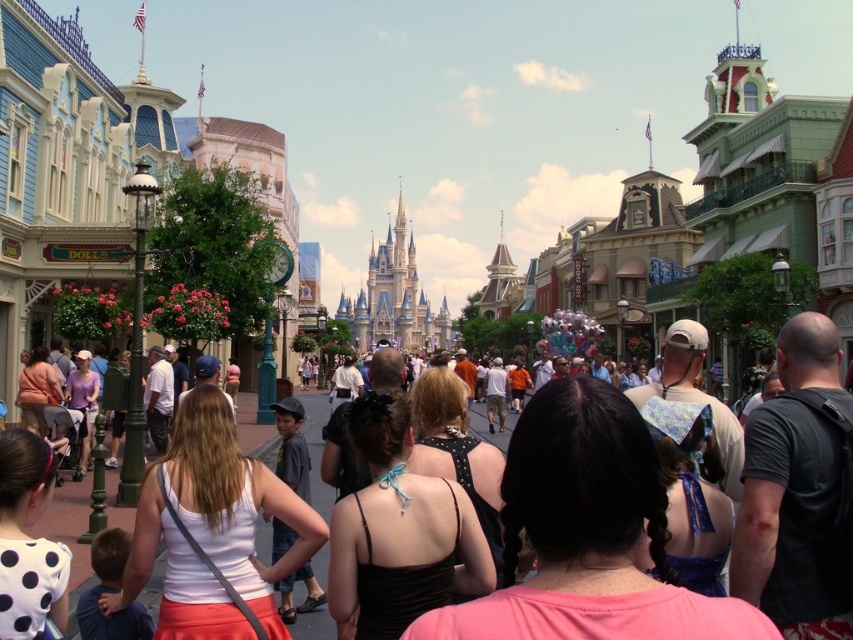
Which is behind, point (427, 577) or point (96, 404)?

Point (96, 404)

In the scene shown: Who is more forward, (381, 556) or (68, 403)?

Point (381, 556) is in front.

Image resolution: width=853 pixels, height=640 pixels. Identify the location of black satin tank top at center. (399, 531).

Does point (315, 516) come farther from viewer compared to point (483, 531)?

No, it is in front of (483, 531).

Measure the distance between point (264, 572) and camera.

Point (264, 572) and camera are 155.76 feet apart from each other.

Identify the location of white matte tank top at center. (213, 529).

Which of these two, black satin dress at center or black leather backpack at right, stands taller?

Standing taller between the two is black leather backpack at right.

Is point (616, 616) behind point (782, 564)?

No, (616, 616) is closer to viewer.

At what (x,y) coordinates should I click in order to perform the action: click on black satin dress at center. Please return your answer as a coordinate pair (x, y). Image resolution: width=853 pixels, height=640 pixels. Looking at the image, I should click on (587, 534).